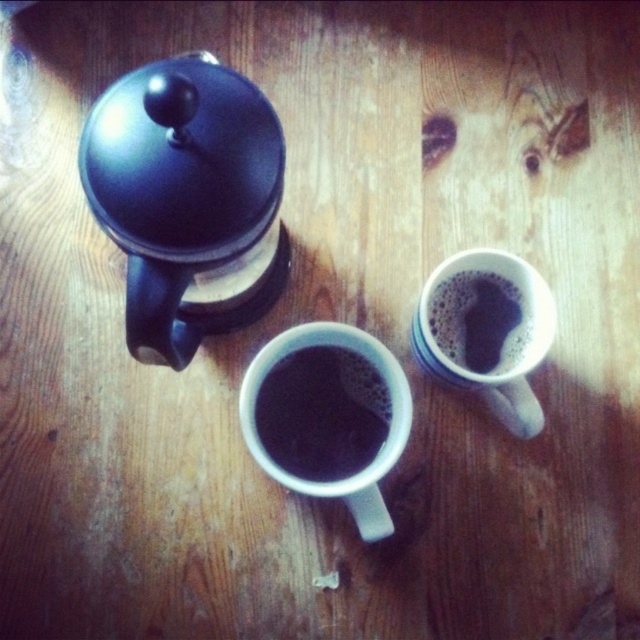
Question: Estimate the real-world distances between objects in this image. Which object is farther from the satin black coffee at upper right?

Choices:
 (A) white glossy mug at center
 (B) matte black coffeepot at upper left

Answer: (B)

Question: Is black matte mug at center positioned before white glossy mug at center?

Choices:
 (A) yes
 (B) no

Answer: (B)

Question: Can you confirm if black matte mug at center is thinner than satin black coffee at upper right?

Choices:
 (A) no
 (B) yes

Answer: (A)

Question: Does matte black coffeepot at upper left come in front of satin black coffee at upper right?

Choices:
 (A) no
 (B) yes

Answer: (B)

Question: Among these points, which one is farthest from the camera?

Choices:
 (A) click(387, 436)
 (B) click(266, 416)
 (C) click(132, 300)

Answer: (B)

Question: Estimate the real-world distances between objects in this image. Which object is farther from the satin black coffee at upper right?

Choices:
 (A) white matte mug at upper right
 (B) matte black coffeepot at upper left
 (C) black matte mug at center

Answer: (B)